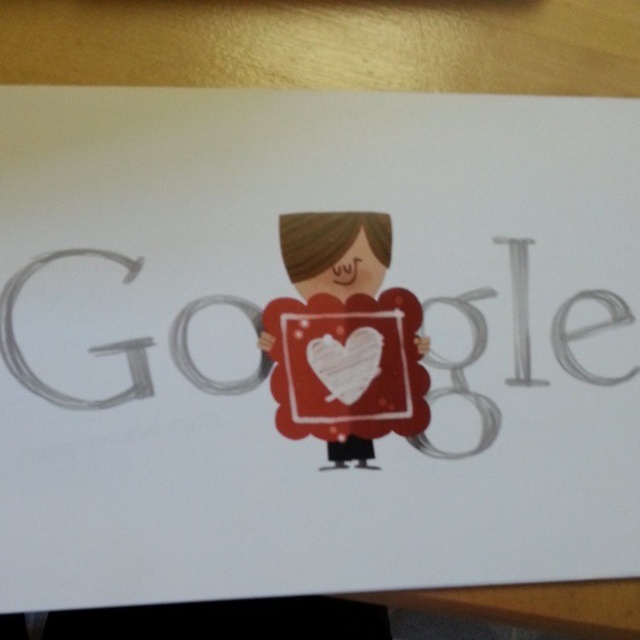
Can you confirm if matte gray google at center is shorter than white paper heart at center?

No, matte gray google at center is not shorter than white paper heart at center.

This screenshot has height=640, width=640. What do you see at coordinates (342, 340) in the screenshot?
I see `matte gray google at center` at bounding box center [342, 340].

At what (x,y) coordinates should I click in order to perform the action: click on matte gray google at center. Please return your answer as a coordinate pair (x, y). The height and width of the screenshot is (640, 640). Looking at the image, I should click on (342, 340).

Based on the photo, is matte paper girl at center thinner than white paper heart at center?

No.

Is matte paper girl at center further to the viewer compared to white paper heart at center?

No, matte paper girl at center is closer to the viewer.

Identify the location of matte paper girl at center. (336, 252).

How much distance is there between matte gray google at center and matte paper girl at center?

A distance of 4.06 centimeters exists between matte gray google at center and matte paper girl at center.

Who is more forward, (x=276, y=374) or (x=314, y=227)?

Point (x=276, y=374)

Locate an element on the screen. matte gray google at center is located at coordinates (342, 340).